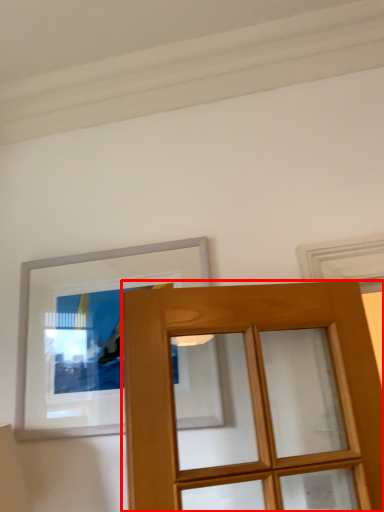
Question: Considering the relative positions of door (annotated by the red box) and picture frame in the image provided, where is door (annotated by the red box) located with respect to the staircase?

Choices:
 (A) right
 (B) left

Answer: (A)